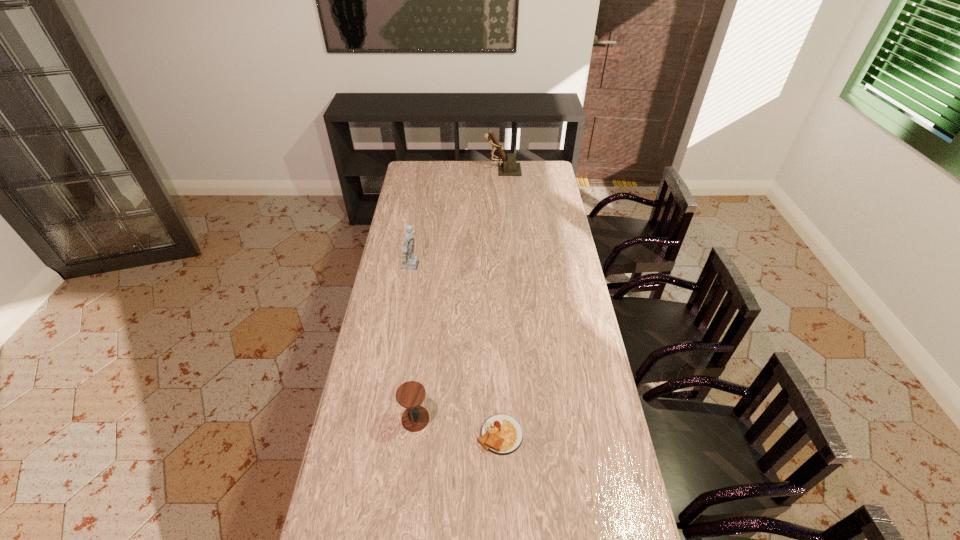
The height and width of the screenshot is (540, 960). What are the coordinates of `free space located on the right of the second shortest object` in the screenshot? It's located at (528, 419).

Find the location of a particular element. The height and width of the screenshot is (540, 960). vacant region located 0.250m on the left of the omelet is located at coordinates (397, 434).

This screenshot has width=960, height=540. In order to click on object located at the far edge in this screenshot , I will do `click(509, 167)`.

The height and width of the screenshot is (540, 960). Identify the location of object positioned at the left edge. (409, 261).

The height and width of the screenshot is (540, 960). In order to click on vacant area at the far edge in this screenshot , I will do `click(447, 172)`.

Where is `vacant area at the left edge of the desktop`? This screenshot has height=540, width=960. vacant area at the left edge of the desktop is located at coordinates (392, 269).

Locate an element on the screen. The height and width of the screenshot is (540, 960). blank space at the right edge of the desktop is located at coordinates (570, 256).

Identify the location of vacant space at the far left corner of the desktop. (428, 180).

Identify the location of vacant space at the far right corner of the desktop. (551, 164).

Locate an element on the screen. free point between the farther figurine and the nearer figurine is located at coordinates (458, 218).